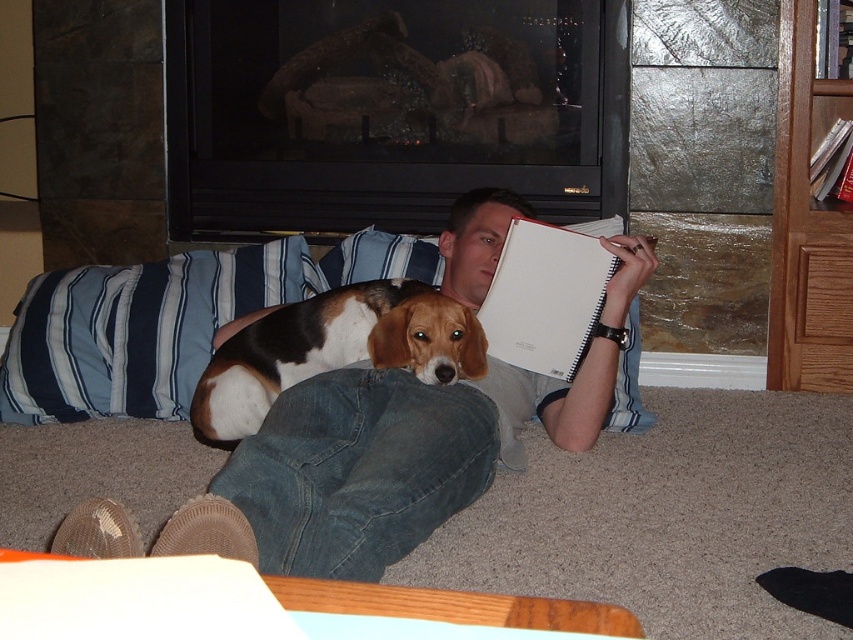
From the picture: Between denim jeans at center and blue striped pillow at left, which one appears on the left side from the viewer's perspective?

From the viewer's perspective, blue striped pillow at left appears more on the left side.

Based on the photo, does denim jeans at center have a greater height compared to blue striped pillow at left?

Yes, denim jeans at center is taller than blue striped pillow at left.

Is point (503, 429) closer to viewer compared to point (68, 296)?

Yes, it is.

The width and height of the screenshot is (853, 640). Find the location of `denim jeans at center`. denim jeans at center is located at coordinates (395, 452).

Who is more forward, (82,536) or (375,368)?

Point (82,536) is more forward.

Can you confirm if denim jeans at center is smaller than tri-colored fur beagle at center?

Actually, denim jeans at center might be larger than tri-colored fur beagle at center.

Is point (289, 516) more distant than point (228, 348)?

No, (289, 516) is in front of (228, 348).

Where is `denim jeans at center`? Image resolution: width=853 pixels, height=640 pixels. denim jeans at center is located at coordinates point(395,452).

Does blue striped pillow at left have a lesser height compared to white matte notebook at center?

No.

In order to click on blue striped pillow at left in this screenshot , I will do click(x=137, y=330).

Between point (16, 358) and point (590, 305), which one is positioned in front?

Point (590, 305) is more forward.

Where is `blue striped pillow at left`? Image resolution: width=853 pixels, height=640 pixels. blue striped pillow at left is located at coordinates (137, 330).